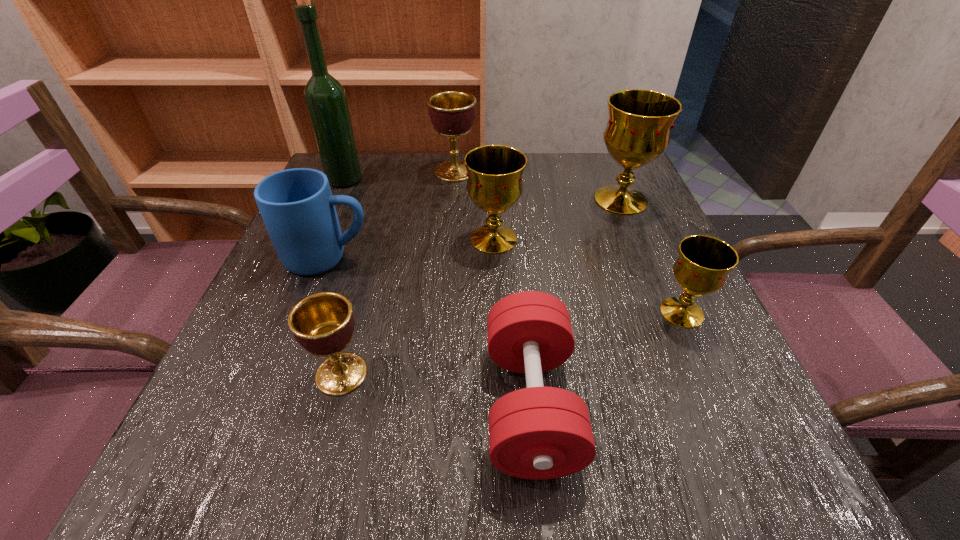
I want to click on blank space at the near edge of the desktop, so click(614, 441).

The width and height of the screenshot is (960, 540). I want to click on free space at the left edge of the desktop, so click(275, 292).

You are a GUI agent. You are given a task and a screenshot of the screen. Output one action in this format:
    pyautogui.click(x=<x>, y=<y>)
    Task: Click on the vacant area at the right edge
    
    Given the screenshot: What is the action you would take?
    pyautogui.click(x=590, y=211)

In the image, there is a desktop. What are the coordinates of `blank space at the near left corner` in the screenshot? It's located at (233, 448).

Where is `free location at the far right corner of the desktop`? This screenshot has width=960, height=540. free location at the far right corner of the desktop is located at coordinates (642, 183).

At what (x,y) coordinates should I click in order to perform the action: click on vacant space at the near right corner. Please return your answer as a coordinate pair (x, y). Looking at the image, I should click on (722, 449).

Where is `unoccupied position between the second nearest gold chalice and the leftmost chalice`? The height and width of the screenshot is (540, 960). unoccupied position between the second nearest gold chalice and the leftmost chalice is located at coordinates (418, 306).

Locate an element on the screen. vacant area that lies between the leftmost gold chalice and the green liquor is located at coordinates (420, 210).

Image resolution: width=960 pixels, height=540 pixels. In order to click on free spot between the nearer golden chalice and the green liquor in this screenshot , I will do `click(343, 277)`.

At what (x,y) coordinates should I click in order to perform the action: click on blank region between the second nearest gold chalice and the second farthest chalice. Please return your answer as a coordinate pair (x, y). The height and width of the screenshot is (540, 960). Looking at the image, I should click on (557, 219).